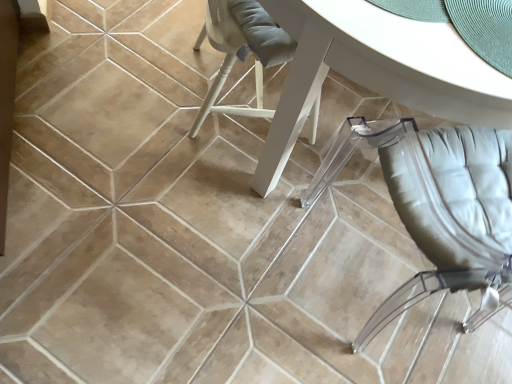
Question: From the image's perspective, would you say white glossy table at center is positioned over transparent leather chair at lower right?

Choices:
 (A) yes
 (B) no

Answer: (A)

Question: Are white glossy table at center and transparent leather chair at lower right beside each other?

Choices:
 (A) no
 (B) yes

Answer: (A)

Question: Considering the relative sizes of white glossy table at center and transparent leather chair at lower right in the image provided, is white glossy table at center shorter than transparent leather chair at lower right?

Choices:
 (A) yes
 (B) no

Answer: (A)

Question: Is white glossy table at center at the right side of transparent leather chair at lower right?

Choices:
 (A) no
 (B) yes

Answer: (A)

Question: Could you tell me if white glossy table at center is facing transparent leather chair at lower right?

Choices:
 (A) yes
 (B) no

Answer: (B)

Question: Is white glossy table at center bigger than transparent leather chair at lower right?

Choices:
 (A) no
 (B) yes

Answer: (B)

Question: Considering the relative sizes of transparent leather chair at lower right and white glossy table at center in the image provided, is transparent leather chair at lower right wider than white glossy table at center?

Choices:
 (A) yes
 (B) no

Answer: (B)

Question: Considering the relative sizes of transparent leather chair at lower right and white glossy table at center in the image provided, is transparent leather chair at lower right shorter than white glossy table at center?

Choices:
 (A) yes
 (B) no

Answer: (B)

Question: Considering the relative positions of transparent leather chair at lower right and white glossy table at center in the image provided, is transparent leather chair at lower right to the right of white glossy table at center from the viewer's perspective?

Choices:
 (A) yes
 (B) no

Answer: (A)

Question: From the image's perspective, is transparent leather chair at lower right beneath white glossy table at center?

Choices:
 (A) no
 (B) yes

Answer: (B)

Question: Considering the relative sizes of transparent leather chair at lower right and white glossy table at center in the image provided, is transparent leather chair at lower right smaller than white glossy table at center?

Choices:
 (A) no
 (B) yes

Answer: (B)

Question: Is transparent leather chair at lower right touching white glossy table at center?

Choices:
 (A) no
 (B) yes

Answer: (A)

Question: Would you say white glossy table at center is inside or outside transparent leather chair at lower right?

Choices:
 (A) inside
 (B) outside

Answer: (B)